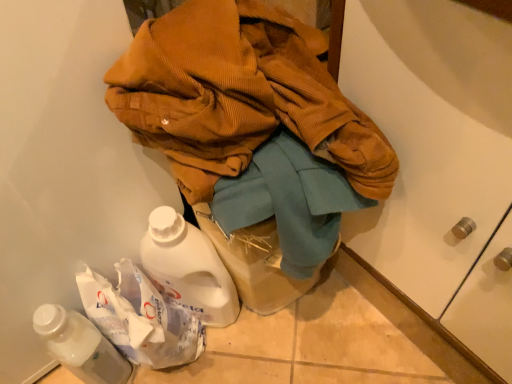
Question: From the image's perspective, is brown corduroy jacket at center located beneath white plastic bottle at lower left?

Choices:
 (A) no
 (B) yes

Answer: (A)

Question: From a real-world perspective, is brown corduroy jacket at center below white plastic bottle at lower left?

Choices:
 (A) no
 (B) yes

Answer: (A)

Question: From a real-world perspective, is brown corduroy jacket at center on top of white plastic bottle at lower left?

Choices:
 (A) yes
 (B) no

Answer: (A)

Question: Is brown corduroy jacket at center bigger than white plastic bottle at lower left?

Choices:
 (A) no
 (B) yes

Answer: (B)

Question: Considering the relative sizes of brown corduroy jacket at center and white plastic bottle at lower left in the image provided, is brown corduroy jacket at center wider than white plastic bottle at lower left?

Choices:
 (A) no
 (B) yes

Answer: (B)

Question: Can you confirm if brown corduroy jacket at center is shorter than white plastic bottle at lower left?

Choices:
 (A) no
 (B) yes

Answer: (A)

Question: Can you confirm if white plastic bottle at lower left is shorter than brown corduroy jacket at center?

Choices:
 (A) no
 (B) yes

Answer: (B)

Question: Could brown corduroy jacket at center be considered to be inside white plastic bottle at lower left?

Choices:
 (A) no
 (B) yes

Answer: (A)

Question: Is white plastic bottle at lower left positioned with its back to brown corduroy jacket at center?

Choices:
 (A) no
 (B) yes

Answer: (B)

Question: Would you say white plastic bottle at lower left is outside brown corduroy jacket at center?

Choices:
 (A) yes
 (B) no

Answer: (A)

Question: From the image's perspective, is white plastic bottle at lower left above brown corduroy jacket at center?

Choices:
 (A) yes
 (B) no

Answer: (B)

Question: Can you confirm if white plastic bottle at lower left is positioned to the right of brown corduroy jacket at center?

Choices:
 (A) no
 (B) yes

Answer: (A)

Question: Which is correct: white plastic bottle at lower left is inside brown corduroy jacket at center, or outside of it?

Choices:
 (A) inside
 (B) outside

Answer: (B)